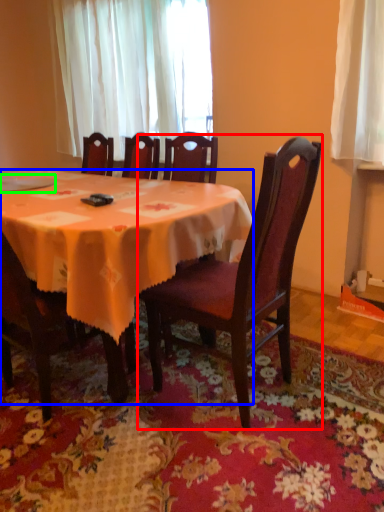
Question: Which object is positioned closest to chair (highlighted by a red box)? Select from kitchen & dining room table (highlighted by a blue box) and tableware (highlighted by a green box).

Choices:
 (A) kitchen & dining room table
 (B) tableware

Answer: (A)